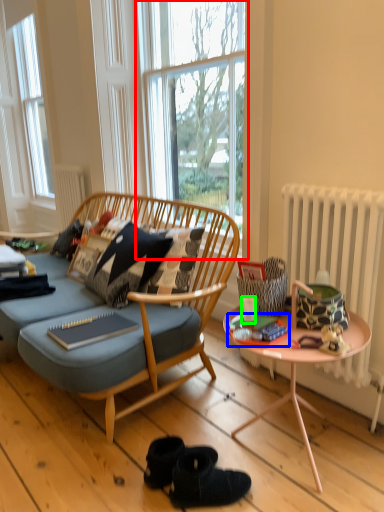
Question: Which is nearer to the window (highlighted by a red box)? magazine (highlighted by a blue box) or coffee cup (highlighted by a green box).

Choices:
 (A) magazine
 (B) coffee cup

Answer: (B)